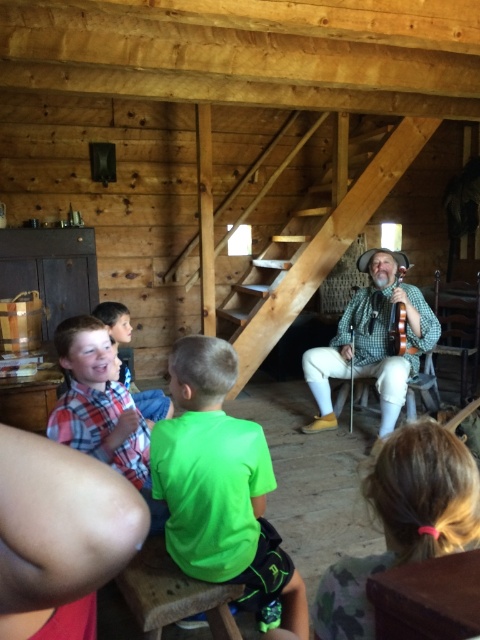
Is point (225, 420) less distant than point (129, 472)?

That is True.

Does green fabric shirt at center appear on the left side of plaid cotton shirt at lower left?

In fact, green fabric shirt at center is to the right of plaid cotton shirt at lower left.

Where is `green fabric shirt at center`? green fabric shirt at center is located at coordinates (220, 484).

Which is more to the left, green plaid shirt at center or plaid shirt at lower left?

plaid shirt at lower left is more to the left.

Does green plaid shirt at center come behind plaid shirt at lower left?

Yes, it is.

Does point (386, 292) come behind point (137, 397)?

That is True.

This screenshot has height=640, width=480. In order to click on green plaid shirt at center in this screenshot , I will do `click(372, 340)`.

Who is more distant from viewer, [211,484] or [108,320]?

Point [108,320]

Consider the image. Does green fabric shirt at center have a greater height compared to plaid shirt at lower left?

Correct, green fabric shirt at center is much taller as plaid shirt at lower left.

Does point (238, 540) come in front of point (124, 371)?

Yes, it is in front of point (124, 371).

Find the location of a particular element. Image resolution: width=480 pixels, height=640 pixels. green fabric shirt at center is located at coordinates (220, 484).